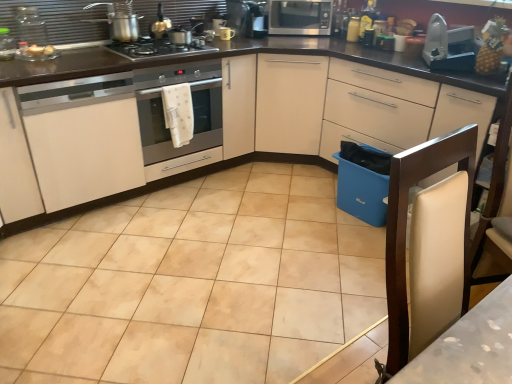
Question: Does yellow textured pineapple at upper right contain beige ceramic tile at center?

Choices:
 (A) no
 (B) yes

Answer: (A)

Question: From the image's perspective, is yellow textured pineapple at upper right beneath beige ceramic tile at center?

Choices:
 (A) yes
 (B) no

Answer: (B)

Question: Could you tell me if yellow textured pineapple at upper right is facing beige ceramic tile at center?

Choices:
 (A) no
 (B) yes

Answer: (A)

Question: Does yellow textured pineapple at upper right have a greater height compared to beige ceramic tile at center?

Choices:
 (A) yes
 (B) no

Answer: (A)

Question: From a real-world perspective, is yellow textured pineapple at upper right below beige ceramic tile at center?

Choices:
 (A) yes
 (B) no

Answer: (B)

Question: From a real-world perspective, is yellow textured pineapple at upper right physically above beige ceramic tile at center?

Choices:
 (A) yes
 (B) no

Answer: (A)

Question: Is the depth of metallic silver pot at upper left less than that of metallic silver toaster at upper center, acting as the 3th appliance starting from the left?

Choices:
 (A) yes
 (B) no

Answer: (A)

Question: Would you say metallic silver pot at upper left is a long distance from metallic silver toaster at upper center, the 4th appliance viewed from the right?

Choices:
 (A) no
 (B) yes

Answer: (A)

Question: Considering the relative positions of metallic silver pot at upper left and metallic silver toaster at upper center, acting as the 3th appliance starting from the left, in the image provided, is metallic silver pot at upper left to the right of metallic silver toaster at upper center, acting as the 3th appliance starting from the left, from the viewer's perspective?

Choices:
 (A) yes
 (B) no

Answer: (B)

Question: Considering the relative sizes of metallic silver pot at upper left and metallic silver toaster at upper center, acting as the 3th appliance starting from the left, in the image provided, is metallic silver pot at upper left wider than metallic silver toaster at upper center, acting as the 3th appliance starting from the left,?

Choices:
 (A) yes
 (B) no

Answer: (A)

Question: From the image's perspective, is metallic silver pot at upper left beneath metallic silver toaster at upper center, the 4th appliance viewed from the right?

Choices:
 (A) yes
 (B) no

Answer: (A)

Question: Is metallic silver pot at upper left bigger than metallic silver toaster at upper center, the 4th appliance viewed from the right?

Choices:
 (A) yes
 (B) no

Answer: (A)

Question: Does satin silver microwave at upper center contain white leather chair at right?

Choices:
 (A) no
 (B) yes

Answer: (A)